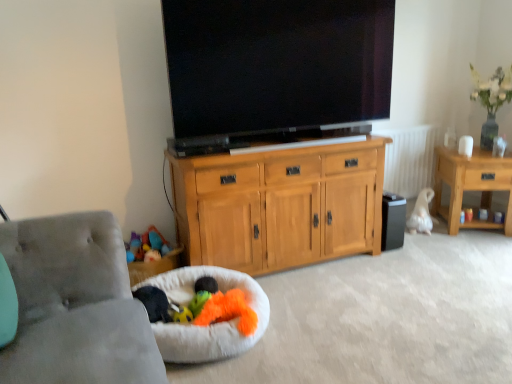
This screenshot has width=512, height=384. Identify the location of free space in front of black plastic speaker at lower right. click(390, 256).